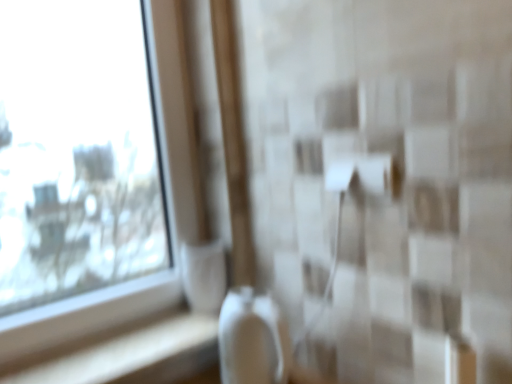
The height and width of the screenshot is (384, 512). What do you see at coordinates (136, 355) in the screenshot? I see `white glossy ledge at lower left` at bounding box center [136, 355].

Locate an element on the screen. white glossy ledge at lower left is located at coordinates (136, 355).

The image size is (512, 384). Describe the element at coordinates (77, 149) in the screenshot. I see `transparent glass window at upper left` at that location.

You are a GUI agent. You are given a task and a screenshot of the screen. Output one action in this format:
    pyautogui.click(x=<x>, y=<y>)
    Task: Click on the transparent glass window at upper left
    The height and width of the screenshot is (384, 512).
    Given the screenshot: What is the action you would take?
    pyautogui.click(x=77, y=149)

Measure the distance between transparent glass window at upper left and camera.

transparent glass window at upper left and camera are 3.83 feet apart from each other.

The image size is (512, 384). In order to click on white glossy ledge at lower left in this screenshot , I will do `click(136, 355)`.

Is white glossy ledge at lower left to the left of transparent glass window at upper left from the viewer's perspective?

In fact, white glossy ledge at lower left is to the right of transparent glass window at upper left.

Is white glossy ledge at lower left positioned in front of transparent glass window at upper left?

That is False.

Considering the points (136, 364) and (11, 171), which point is behind, point (136, 364) or point (11, 171)?

Positioned behind is point (11, 171).

From the image's perspective, is white glossy ledge at lower left positioned above or below transparent glass window at upper left?

From the image's perspective, white glossy ledge at lower left appears below transparent glass window at upper left.

From a real-world perspective, which is physically above, white glossy ledge at lower left or transparent glass window at upper left?

transparent glass window at upper left.

Which object is wider, white glossy ledge at lower left or transparent glass window at upper left?

white glossy ledge at lower left.

Can you confirm if white glossy ledge at lower left is taller than transparent glass window at upper left?

No, white glossy ledge at lower left is not taller than transparent glass window at upper left.

In terms of size, does white glossy ledge at lower left appear bigger or smaller than transparent glass window at upper left?

In the image, white glossy ledge at lower left appears to be smaller than transparent glass window at upper left.

Would you say white glossy ledge at lower left is outside transparent glass window at upper left?

Indeed, white glossy ledge at lower left is completely outside transparent glass window at upper left.

Are white glossy ledge at lower left and transparent glass window at upper left beside each other?

No, white glossy ledge at lower left is not beside transparent glass window at upper left.

Is white glossy ledge at lower left oriented away from transparent glass window at upper left?

That's right, white glossy ledge at lower left is facing away from transparent glass window at upper left.

What's the angular difference between white glossy ledge at lower left and transparent glass window at upper left's facing directions?

The facing directions of white glossy ledge at lower left and transparent glass window at upper left are 0.000978 degrees apart.

Identify the location of ledge lying on the right of transparent glass window at upper left. click(136, 355).

In the scene shown: Based on their positions, is transparent glass window at upper left located to the left or right of white glossy ledge at lower left?

Based on their positions, transparent glass window at upper left is located to the left of white glossy ledge at lower left.

Consider the image. Is transparent glass window at upper left in front of or behind white glossy ledge at lower left in the image?

transparent glass window at upper left is positioned closer to the viewer than white glossy ledge at lower left.

Is point (45, 127) positioned before point (53, 363)?

No, (45, 127) is behind (53, 363).

From the image's perspective, would you say transparent glass window at upper left is shown under white glossy ledge at lower left?

No.

From a real-world perspective, who is located lower, transparent glass window at upper left or white glossy ledge at lower left?

In real-world perspective, white glossy ledge at lower left is lower.

Looking at their sizes, would you say transparent glass window at upper left is wider or thinner than white glossy ledge at lower left?

Clearly, transparent glass window at upper left has less width compared to white glossy ledge at lower left.

Considering the sizes of objects transparent glass window at upper left and white glossy ledge at lower left in the image provided, who is shorter, transparent glass window at upper left or white glossy ledge at lower left?

white glossy ledge at lower left is shorter.

Considering the sizes of transparent glass window at upper left and white glossy ledge at lower left in the image, is transparent glass window at upper left bigger or smaller than white glossy ledge at lower left?

In the image, transparent glass window at upper left appears to be larger than white glossy ledge at lower left.

Consider the image. Is white glossy ledge at lower left located within transparent glass window at upper left?

No, white glossy ledge at lower left is not inside transparent glass window at upper left.

Is transparent glass window at upper left next to white glossy ledge at lower left and touching it?

No.

Is transparent glass window at upper left facing towards white glossy ledge at lower left?

Yes, transparent glass window at upper left is oriented towards white glossy ledge at lower left.

How different are the orientations of transparent glass window at upper left and white glossy ledge at lower left in degrees?

They differ by 0.000978 degrees in their facing directions.

Measure the distance from transparent glass window at upper left to white glossy ledge at lower left.

The distance of transparent glass window at upper left from white glossy ledge at lower left is 38.30 inches.

This screenshot has height=384, width=512. I want to click on window that appears above the white glossy ledge at lower left (from a real-world perspective), so click(x=77, y=149).

Identify the location of window that is on the left side of white glossy ledge at lower left. The width and height of the screenshot is (512, 384). (77, 149).

In the image, there is a white glossy ledge at lower left. Identify the location of window above it (from the image's perspective). tap(77, 149).